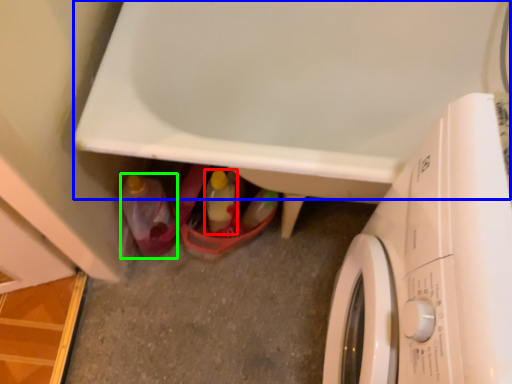
Question: Based on their relative distances, which object is nearer to bottle (highlighted by a red box)? Choose from bath (highlighted by a blue box) and bottle (highlighted by a green box).

Choices:
 (A) bath
 (B) bottle

Answer: (B)